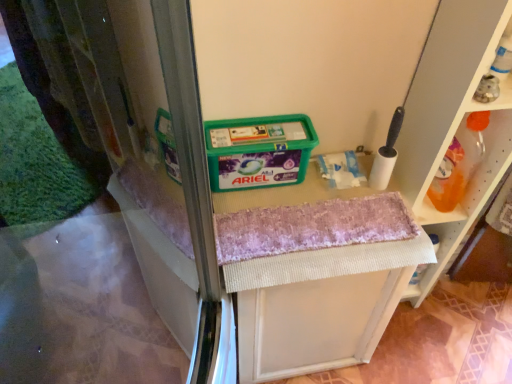
Find the location of a particular element. vacant space to the right of textured fabric vanity at center is located at coordinates (417, 344).